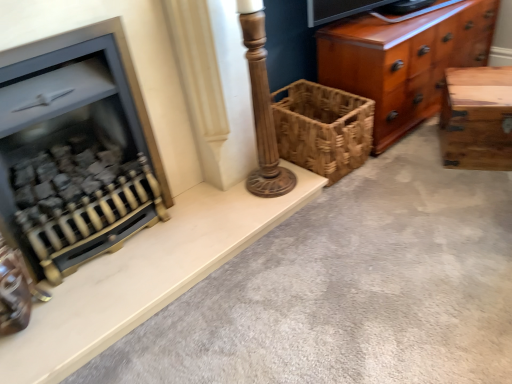
Question: Is wooden column at center behind woven brown basket at center?

Choices:
 (A) yes
 (B) no

Answer: (B)

Question: Is wooden column at center to the right of woven brown basket at center from the viewer's perspective?

Choices:
 (A) no
 (B) yes

Answer: (A)

Question: Is wooden column at center outside woven brown basket at center?

Choices:
 (A) yes
 (B) no

Answer: (A)

Question: Does wooden column at center have a smaller size compared to woven brown basket at center?

Choices:
 (A) no
 (B) yes

Answer: (B)

Question: Is wooden column at center taller than woven brown basket at center?

Choices:
 (A) no
 (B) yes

Answer: (B)

Question: Is wooden column at center at the left side of woven brown basket at center?

Choices:
 (A) no
 (B) yes

Answer: (B)

Question: Can you confirm if white marble fireplace at left is positioned to the left of wooden column at center?

Choices:
 (A) no
 (B) yes

Answer: (B)

Question: Is white marble fireplace at left next to wooden column at center?

Choices:
 (A) yes
 (B) no

Answer: (B)

Question: From a real-world perspective, does white marble fireplace at left stand above wooden column at center?

Choices:
 (A) yes
 (B) no

Answer: (B)

Question: From the image's perspective, is white marble fireplace at left on wooden column at center?

Choices:
 (A) no
 (B) yes

Answer: (A)

Question: Does white marble fireplace at left have a lesser width compared to wooden column at center?

Choices:
 (A) no
 (B) yes

Answer: (A)

Question: From a real-world perspective, is white marble fireplace at left under wooden column at center?

Choices:
 (A) yes
 (B) no

Answer: (A)

Question: From the image's perspective, is shiny brown wood chest of drawers at right beneath natural wood trunk at right?

Choices:
 (A) no
 (B) yes

Answer: (A)